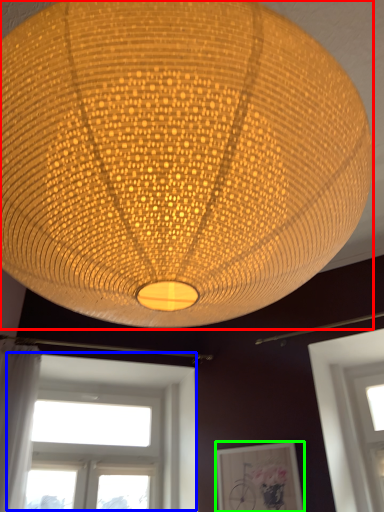
Question: Estimate the real-world distances between objects in this image. Which object is closer to lamp (highlighted by a red box), window (highlighted by a blue box) or picture frame (highlighted by a green box)?

Choices:
 (A) window
 (B) picture frame

Answer: (B)